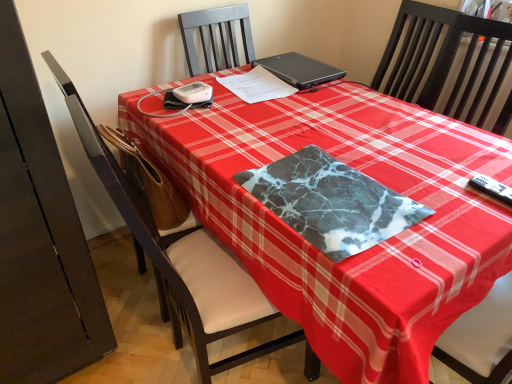
Question: Considering the relative sizes of white paper at center and black matte laptop at upper center in the image provided, is white paper at center bigger than black matte laptop at upper center?

Choices:
 (A) yes
 (B) no

Answer: (B)

Question: Does white paper at center appear on the left side of black matte laptop at upper center?

Choices:
 (A) no
 (B) yes

Answer: (B)

Question: Does white paper at center have a lesser height compared to black matte laptop at upper center?

Choices:
 (A) yes
 (B) no

Answer: (A)

Question: Does white paper at center have a smaller size compared to black matte laptop at upper center?

Choices:
 (A) yes
 (B) no

Answer: (A)

Question: From a real-world perspective, is white paper at center below black matte laptop at upper center?

Choices:
 (A) no
 (B) yes

Answer: (B)

Question: Is white paper at center closer to camera compared to black matte laptop at upper center?

Choices:
 (A) yes
 (B) no

Answer: (A)

Question: From the image's perspective, would you say white paper at center is shown under brown leather swivel chair at left?

Choices:
 (A) no
 (B) yes

Answer: (A)

Question: Could you tell me if white paper at center is facing brown leather swivel chair at left?

Choices:
 (A) no
 (B) yes

Answer: (A)

Question: Is white paper at center placed right next to brown leather swivel chair at left?

Choices:
 (A) no
 (B) yes

Answer: (A)

Question: Is white paper at center looking in the opposite direction of brown leather swivel chair at left?

Choices:
 (A) no
 (B) yes

Answer: (A)

Question: Does white paper at center appear on the right side of brown leather swivel chair at left?

Choices:
 (A) yes
 (B) no

Answer: (A)

Question: Is white paper at center further to the viewer compared to brown leather swivel chair at left?

Choices:
 (A) yes
 (B) no

Answer: (A)

Question: Considering the relative sizes of marble-like fabric at center and black matte laptop at upper center in the image provided, is marble-like fabric at center smaller than black matte laptop at upper center?

Choices:
 (A) no
 (B) yes

Answer: (B)